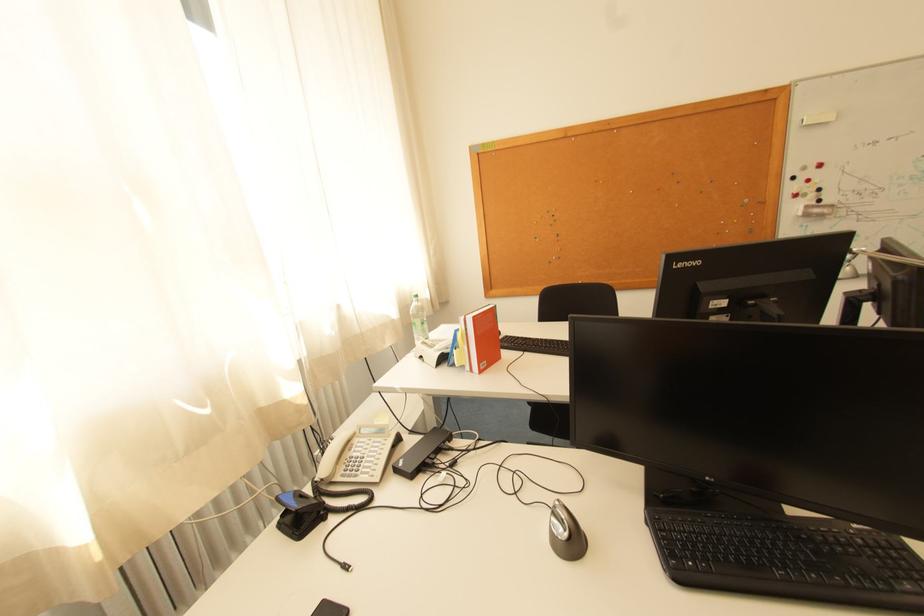
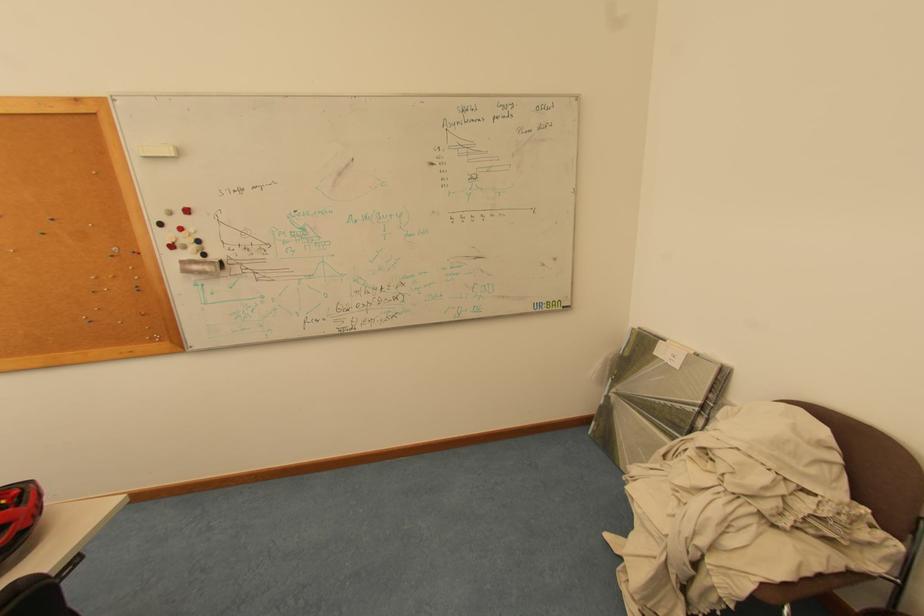
The point at (812, 197) is marked in the first image. Where is the corresponding point in the second image?

(193, 249)